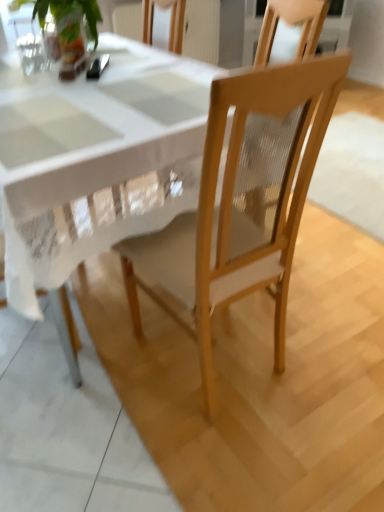
Locate an element on the screen. The image size is (384, 512). green leafy plant at upper left is located at coordinates (68, 28).

Measure the distance between metallic silver spoon at upper left and camera.

The depth of metallic silver spoon at upper left is 5.02 feet.

Image resolution: width=384 pixels, height=512 pixels. Find the location of `white glossy table at center`. white glossy table at center is located at coordinates (95, 164).

Is point (221, 120) in front of point (107, 62)?

Yes, point (221, 120) is in front of point (107, 62).

Can you confirm if light wood chair at center is shorter than metallic silver spoon at upper left?

In fact, light wood chair at center may be taller than metallic silver spoon at upper left.

Between light wood chair at center and metallic silver spoon at upper left, which one has larger size?

With larger size is light wood chair at center.

Can you confirm if light wood chair at center is positioned to the left of metallic silver spoon at upper left?

Incorrect, light wood chair at center is not on the left side of metallic silver spoon at upper left.

Is light wood chair at center oriented towards white glossy table at center?

Yes, light wood chair at center is facing white glossy table at center.

Considering the relative positions of light wood chair at center and white glossy table at center in the image provided, is light wood chair at center to the right of white glossy table at center from the viewer's perspective?

Yes.

Which of these two, light wood chair at center or white glossy table at center, is wider?

white glossy table at center is wider.

Is light wood chair at center not inside white glossy table at center?

No, light wood chair at center is inside white glossy table at center's boundary.

Could you tell me if light wood chair at center is turned towards green leafy plant at upper left?

Yes, light wood chair at center faces towards green leafy plant at upper left.

Looking at this image, which is closer, (303, 72) or (92, 5)?

Positioned in front is point (303, 72).

Does light wood chair at center appear on the left side of green leafy plant at upper left?

In fact, light wood chair at center is to the right of green leafy plant at upper left.

Considering the positions of points (85, 213) and (98, 58), is point (85, 213) closer to camera compared to point (98, 58)?

That is True.

From a real-world perspective, who is located higher, white glossy table at center or metallic silver spoon at upper left?

metallic silver spoon at upper left.

Is white glossy table at center facing away from metallic silver spoon at upper left?

No, metallic silver spoon at upper left is not at the back of white glossy table at center.

From the picture: Is white glossy table at center located outside metallic silver spoon at upper left?

white glossy table at center lies outside metallic silver spoon at upper left's area.

Looking at this image, how different are the orientations of white glossy table at center and light wood chair at center in degrees?

The angular difference between white glossy table at center and light wood chair at center is 176 degrees.

Where is `round table behind the light wood chair at center`? Image resolution: width=384 pixels, height=512 pixels. round table behind the light wood chair at center is located at coordinates (95, 164).

Between white glossy table at center and light wood chair at center, which one appears on the right side from the viewer's perspective?

From the viewer's perspective, light wood chair at center appears more on the right side.

From the image's perspective, would you say white glossy table at center is shown under light wood chair at center?

Incorrect, from the image's perspective, white glossy table at center is higher than light wood chair at center.

Is metallic silver spoon at upper left placed right next to light wood chair at center?

There is a gap between metallic silver spoon at upper left and light wood chair at center.

Which is more to the left, metallic silver spoon at upper left or light wood chair at center?

From the viewer's perspective, metallic silver spoon at upper left appears more on the left side.

Locate an element on the screen. The image size is (384, 512). chair directly beneath the metallic silver spoon at upper left (from a real-world perspective) is located at coordinates (243, 201).

Is metallic silver spoon at upper left located outside light wood chair at center?

Yes, metallic silver spoon at upper left is located beyond the bounds of light wood chair at center.

In the image, is green leafy plant at upper left positioned in front of or behind light wood chair at center?

green leafy plant at upper left is positioned farther from the viewer than light wood chair at center.

Could you tell me if green leafy plant at upper left is turned towards light wood chair at center?

Yes, green leafy plant at upper left is facing light wood chair at center.

What's the angular difference between green leafy plant at upper left and light wood chair at center's facing directions?

The facing directions of green leafy plant at upper left and light wood chair at center are 176 degrees apart.

Looking at the image, does green leafy plant at upper left seem bigger or smaller compared to light wood chair at center?

Clearly, green leafy plant at upper left is smaller in size than light wood chair at center.

Locate an element on the screen. tableware that is on the left side of light wood chair at center is located at coordinates (97, 67).

At what (x,y) coordinates should I click in order to perform the action: click on round table located underneath the light wood chair at center (from a real-world perspective). Please return your answer as a coordinate pair (x, y). Looking at the image, I should click on tap(95, 164).

From the image, which object appears to be farther from white glossy table at center, light wood chair at center or metallic silver spoon at upper left?

Among the two, metallic silver spoon at upper left is located further to white glossy table at center.

When comparing their distances from green leafy plant at upper left, does metallic silver spoon at upper left or white glossy table at center seem closer?

metallic silver spoon at upper left is closer to green leafy plant at upper left.

Considering their positions, is green leafy plant at upper left positioned further to white glossy table at center than light wood chair at center?

green leafy plant at upper left is positioned further to the anchor white glossy table at center.

When comparing their distances from green leafy plant at upper left, does white glossy table at center or light wood chair at center seem further?

light wood chair at center is positioned further to the anchor green leafy plant at upper left.

Based on their spatial positions, is green leafy plant at upper left or light wood chair at center closer to metallic silver spoon at upper left?

The object closer to metallic silver spoon at upper left is green leafy plant at upper left.

Based on their spatial positions, is light wood chair at center or white glossy table at center further from metallic silver spoon at upper left?

light wood chair at center is further to metallic silver spoon at upper left.

From the image, which object appears to be farther from metallic silver spoon at upper left, green leafy plant at upper left or white glossy table at center?

white glossy table at center lies further to metallic silver spoon at upper left than the other object.

From the image, which object appears to be farther from metallic silver spoon at upper left, white glossy table at center or green leafy plant at upper left?

white glossy table at center is positioned further to the anchor metallic silver spoon at upper left.

Find the location of a particular element. round table between green leafy plant at upper left and light wood chair at center in the vertical direction is located at coordinates (95, 164).

You are a GUI agent. You are given a task and a screenshot of the screen. Output one action in this format:
    pyautogui.click(x=<x>, y=<y>)
    Task: Click on the round table located between light wood chair at center and metallic silver spoon at upper left in the depth direction
    The height and width of the screenshot is (512, 384).
    Given the screenshot: What is the action you would take?
    pyautogui.click(x=95, y=164)

You are a GUI agent. You are given a task and a screenshot of the screen. Output one action in this format:
    pyautogui.click(x=<x>, y=<y>)
    Task: Click on the houseplant between light wood chair at center and metallic silver spoon at upper left from front to back
    Image resolution: width=384 pixels, height=512 pixels.
    Given the screenshot: What is the action you would take?
    pyautogui.click(x=68, y=28)

The width and height of the screenshot is (384, 512). Find the location of `houseplant positioned between white glossy table at center and metallic silver spoon at upper left from near to far`. houseplant positioned between white glossy table at center and metallic silver spoon at upper left from near to far is located at coordinates (68, 28).